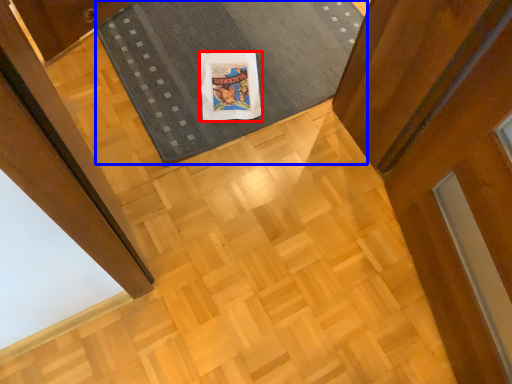
Question: Which object appears farthest to the camera in this image, comic book character (highlighted by a red box) or mat (highlighted by a blue box)?

Choices:
 (A) comic book character
 (B) mat

Answer: (A)